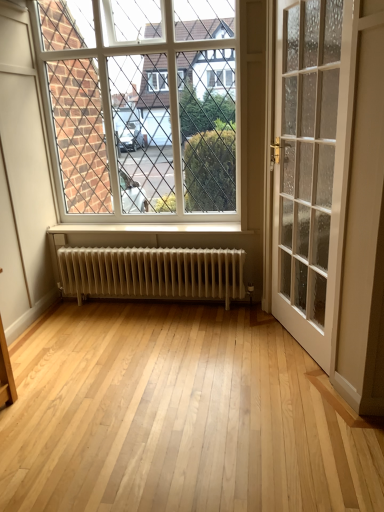
This screenshot has width=384, height=512. I want to click on vacant space in front of white metallic radiator at center, so click(188, 365).